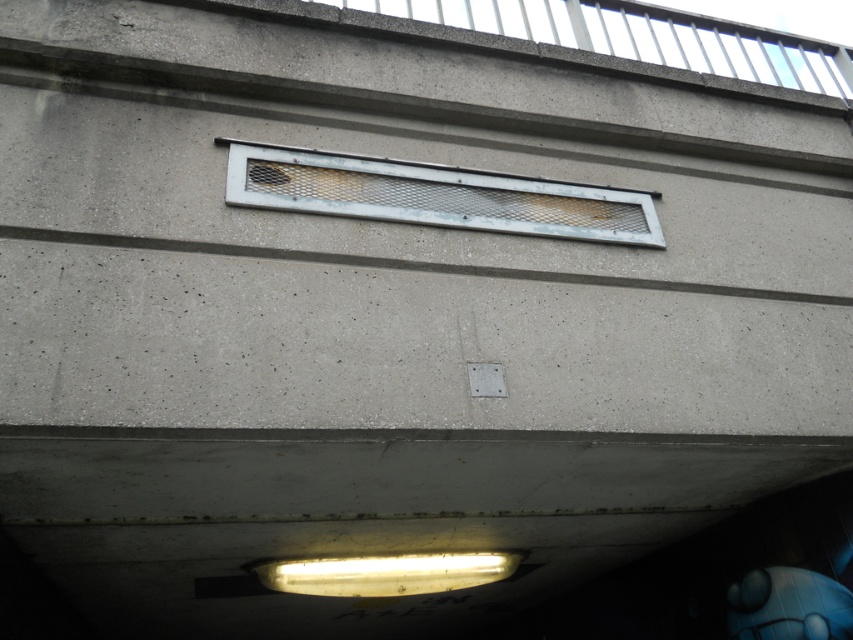
You are a maintenance worker inspecting the concrete structure. You need to locate the metal mesh vent at center. According to the coordinates provided, where should you look?

You should look at point (434, 195) to find the metal mesh vent at center.

You are a maintenance worker inspecting the concrete structure. You need to replace the smaller metal mesh vent. Which one should you choose between the metal mesh vent at center and the metal mesh vent at upper center?

The metal mesh vent at center has a smaller width compared to the metal mesh vent at upper center, so you should choose the metal mesh vent at center to replace the smaller one.